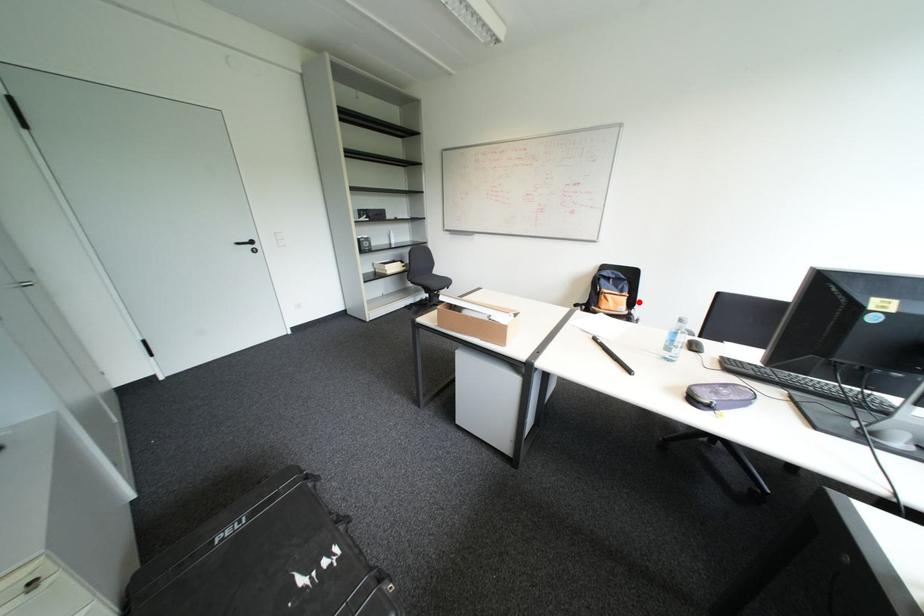
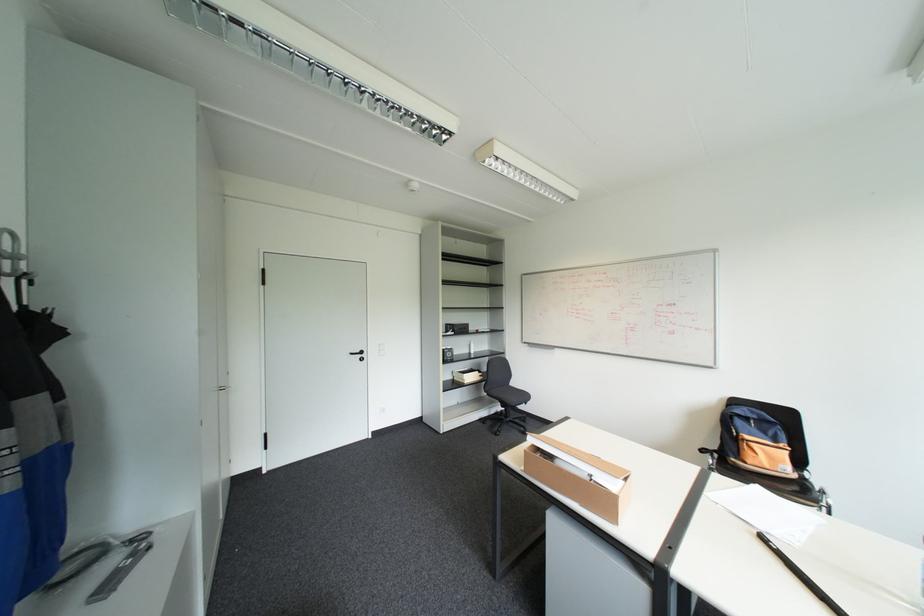
Question: I am providing you with two images of the same scene from different viewpoints. In image1, a red point is highlighted. Considering the same 3D point in image2, which of the following is correct?

Choices:
 (A) It is closer
 (B) It is farther

Answer: (A)